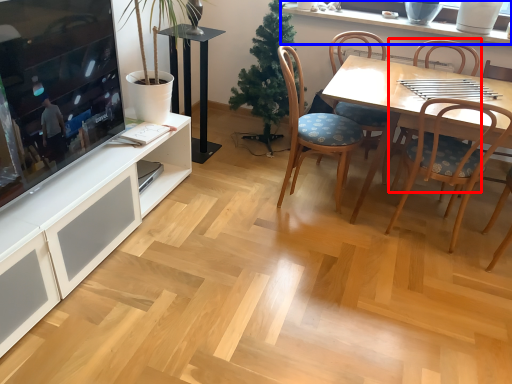
Question: Which object is closer to the camera taking this photo, chair (highlighted by a red box) or window sill (highlighted by a blue box)?

Choices:
 (A) chair
 (B) window sill

Answer: (A)